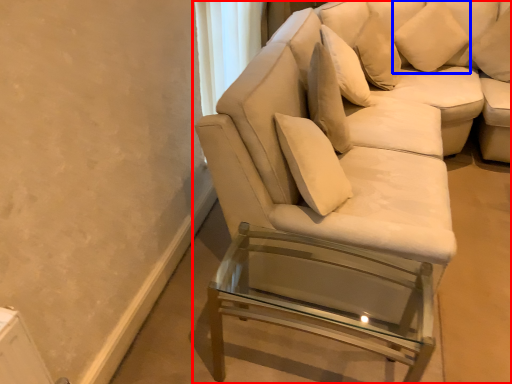
Question: Which object appears farthest to the camera in this image, studio couch (highlighted by a red box) or pillow (highlighted by a blue box)?

Choices:
 (A) studio couch
 (B) pillow

Answer: (B)